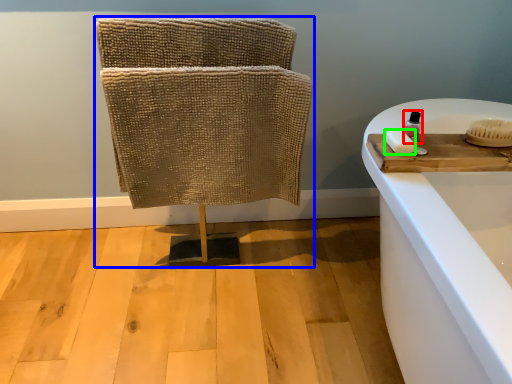
Question: Which is farther away from toiletry (highlighted by a red box)? furniture (highlighted by a blue box) or soap (highlighted by a green box)?

Choices:
 (A) furniture
 (B) soap

Answer: (A)